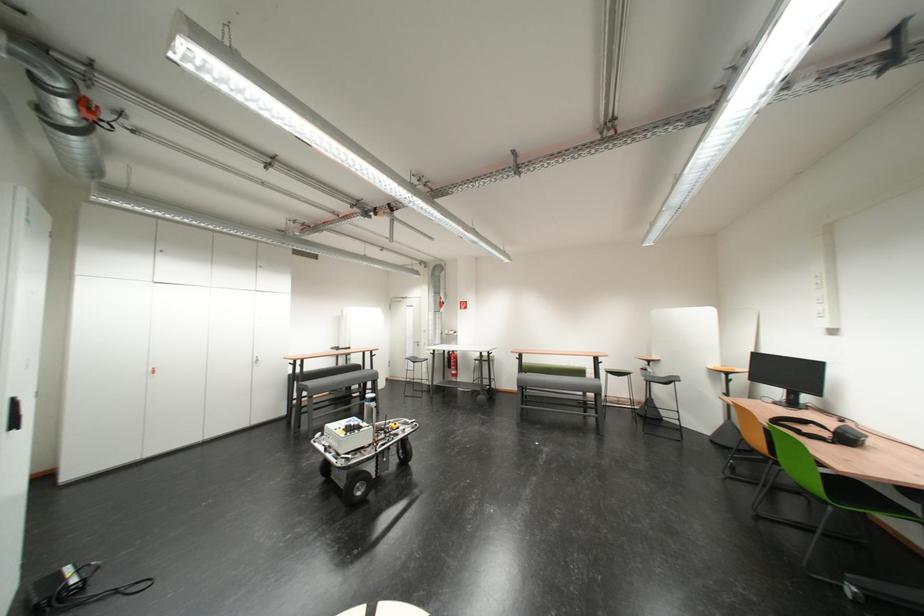
This screenshot has width=924, height=616. In order to click on black dial in this screenshot , I will do `click(848, 436)`.